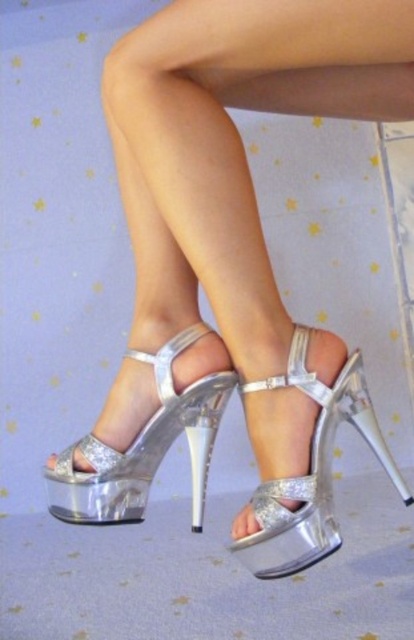
You are a fashion designer examining a pair of sandals. You notice two items labeled as shiny silver sandal at center and shiny metallic platform sandal at center. Which one is positioned to the left?

The shiny silver sandal at center is positioned to the left of the shiny metallic platform sandal at center.

You are a shoe designer trying to create a pair of sandals that match the style of the shiny silver sandal at center and the shiny metallic platform sandal at center. Which one should you choose as the base design if you want to create a larger version of the sandal?

You should choose the shiny silver sandal at center as the base design because it has a larger size compared to the shiny metallic platform sandal at center, making it easier to scale up for a larger version.

You are a photographer trying to capture the shiny silver sandal at center and the shiny metallic platform sandal at center in focus. Which one should you adjust your camera focus on first to ensure clarity?

The shiny silver sandal at center is closer to the viewer than the shiny metallic platform sandal at center, so you should focus on the shiny silver sandal at center first to ensure clarity.